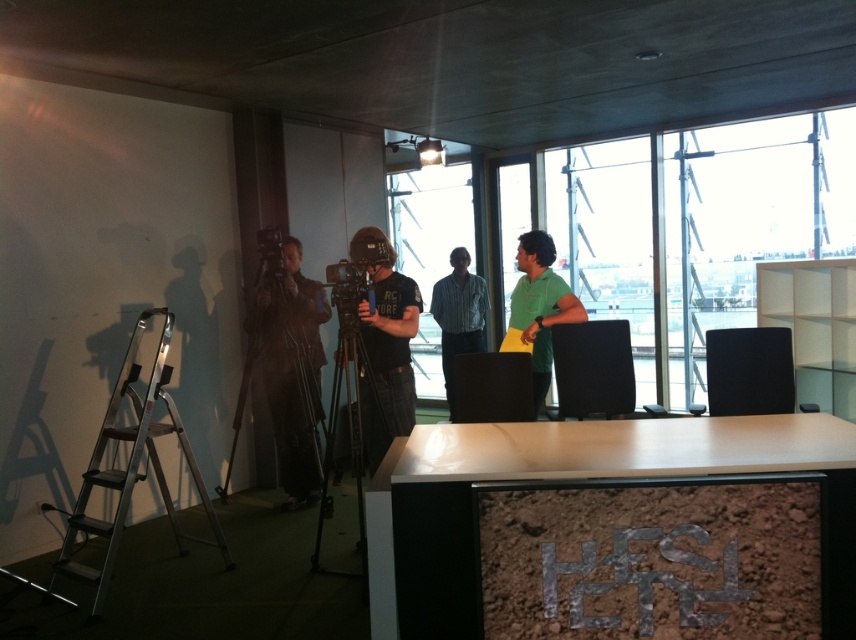
You are an office worker who needs to reach a high shelf in the room. You see a silver metallic ladder at left and a striped shirt at center. Which object can you use to reach the shelf?

The silver metallic ladder at left has a larger size compared to striped shirt at center, so the ladder is more suitable for reaching the high shelf.